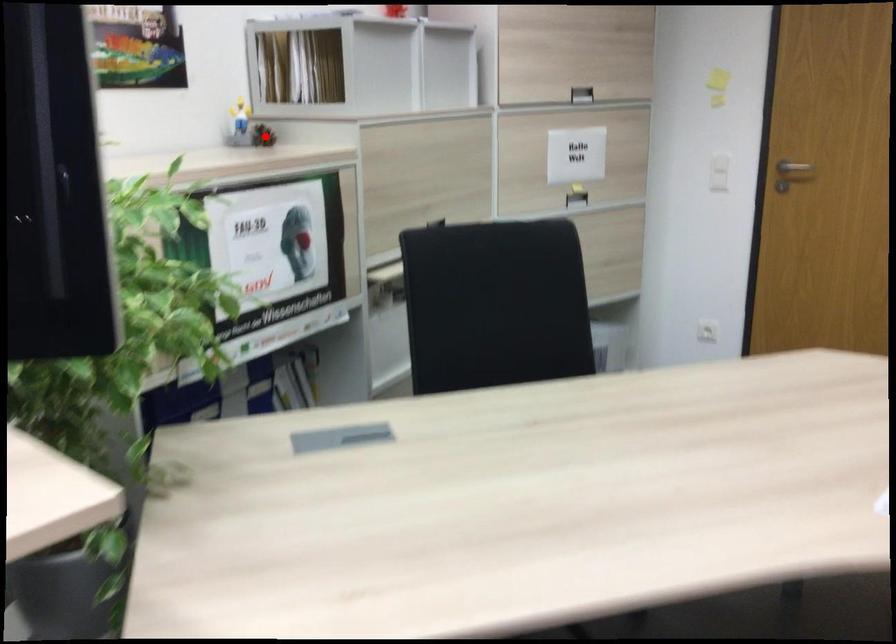
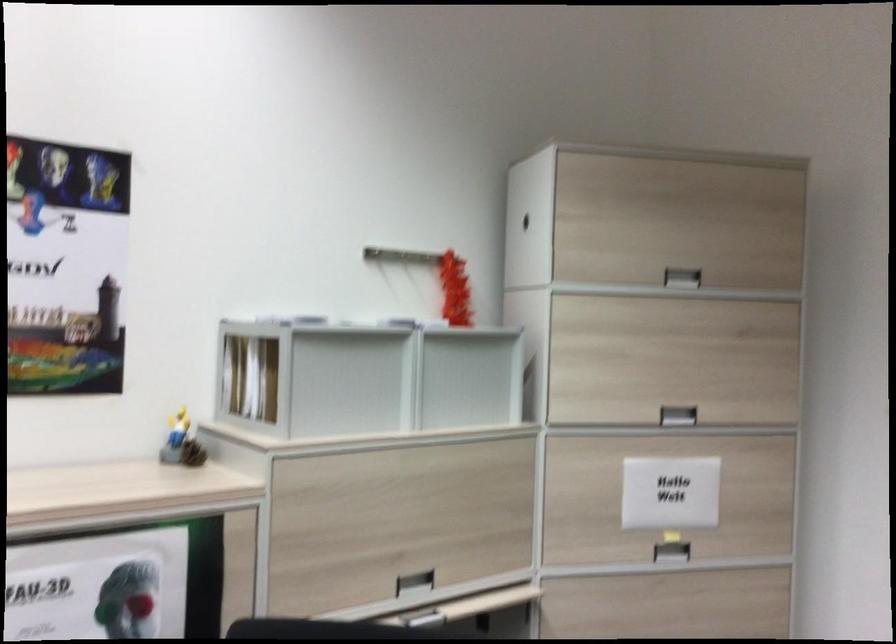
Question: I am providing you with two images of the same scene from different viewpoints. Image1 has a red point marked. In image2, the corresponding 3D location appears at what relative position? Reply with the corresponding letter.

Choices:
 (A) Closer
 (B) Farther

Answer: (A)